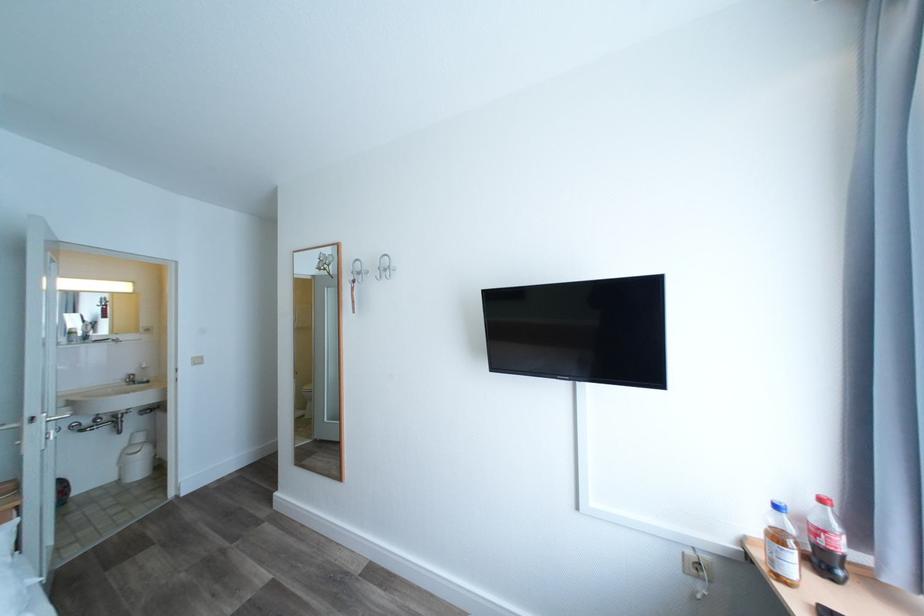
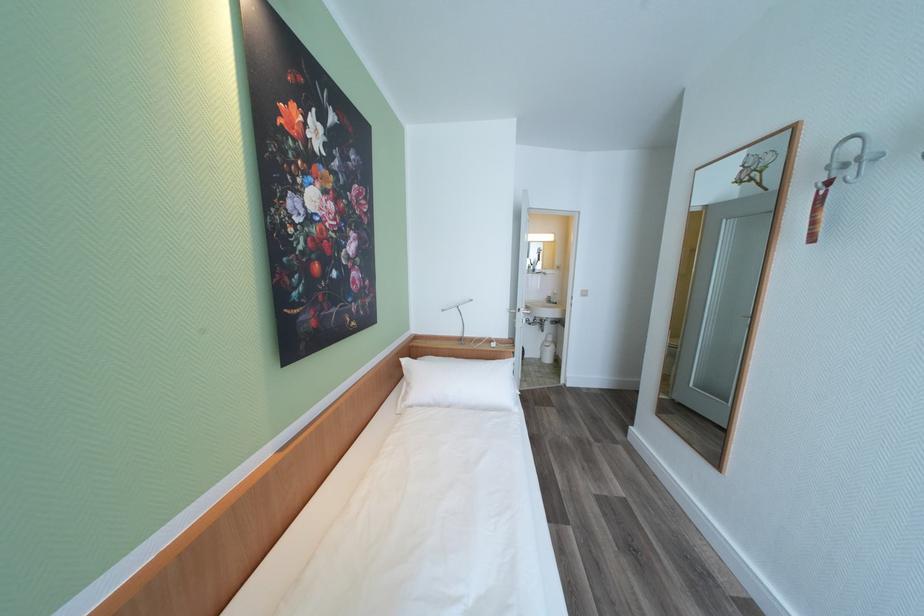
Locate, in the second image, the point that corresponds to (x=41, y=419) in the first image.

(527, 310)